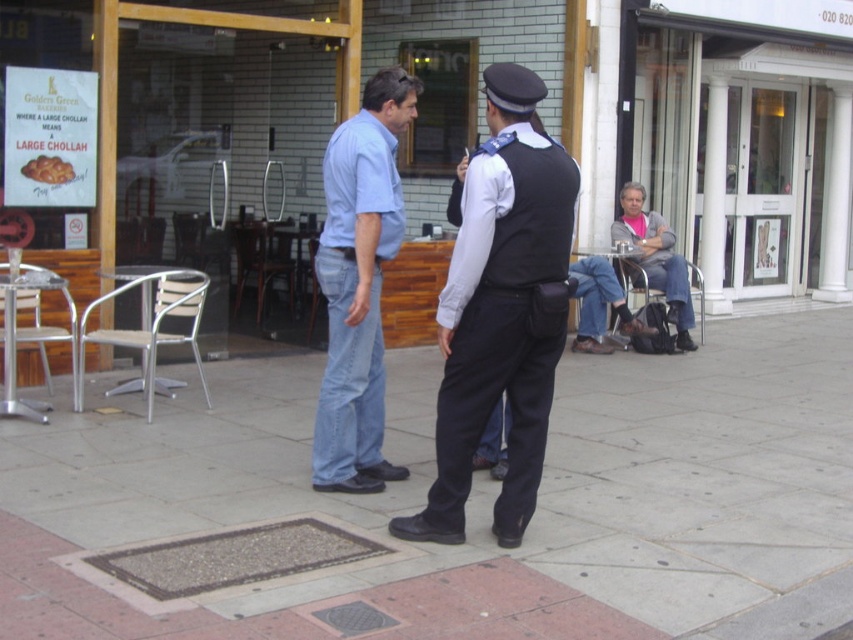
You are a delivery person standing at the entrance of the store. You need to hand over a package to the police officer. Where should you walk to find the dark blue fabric vest at center?

The dark blue fabric vest at center is located at the coordinates point (500, 323), so you should walk towards that point to find the police officer.

You are a delivery person who needs to place a small package on the ground. The smooth concrete pavement at center and gray sweater at right are both visible. Which surface is more suitable for placing the package?

The smooth concrete pavement at center is more suitable because it has a smaller size compared to the gray sweater at right, making it a stable and flat surface for placing the package.